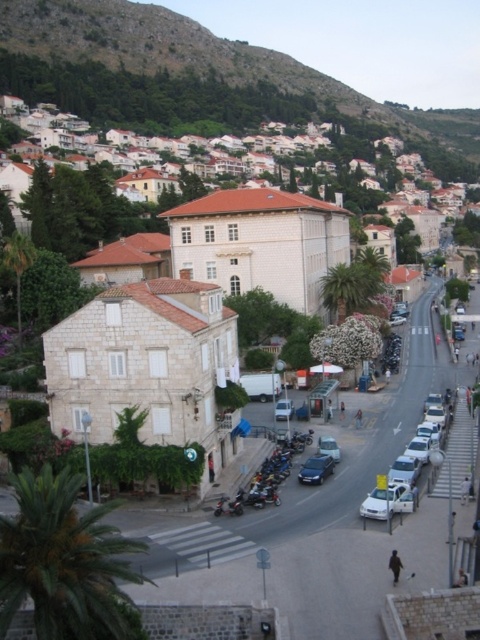
Question: Observing the image, what is the correct spatial positioning of green leafy palm tree at left in reference to metallic silver car at center?

Choices:
 (A) below
 (B) above

Answer: (B)

Question: Which point appears closest to the camera in this image?

Choices:
 (A) (337, 460)
 (B) (322, 285)
 (C) (286, 401)

Answer: (A)

Question: Can you confirm if shiny chrome motorcycle at center is positioned below metallic silver car at center?

Choices:
 (A) yes
 (B) no

Answer: (A)

Question: Which of the following is the closest to the observer?

Choices:
 (A) white stone building at center
 (B) metallic silver car at center

Answer: (A)

Question: Which of the following is the farthest from the observer?

Choices:
 (A) shiny chrome motorcycle at center
 (B) white matte car at center-right
 (C) white stone building at center

Answer: (C)

Question: In this image, where is white matte car at center-right located relative to shiny chrome motorcycle at center?

Choices:
 (A) left
 (B) right

Answer: (B)